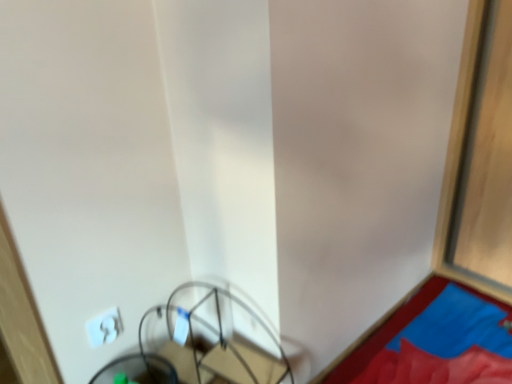
Question: Is the position of metallic wire swivel chair at lower left less distant than that of blue fabric at lower right?

Choices:
 (A) no
 (B) yes

Answer: (B)

Question: Does metallic wire swivel chair at lower left have a smaller size compared to blue fabric at lower right?

Choices:
 (A) no
 (B) yes

Answer: (B)

Question: Is metallic wire swivel chair at lower left taller than blue fabric at lower right?

Choices:
 (A) yes
 (B) no

Answer: (A)

Question: Does metallic wire swivel chair at lower left have a larger size compared to blue fabric at lower right?

Choices:
 (A) yes
 (B) no

Answer: (B)

Question: Can you confirm if metallic wire swivel chair at lower left is positioned to the right of blue fabric at lower right?

Choices:
 (A) no
 (B) yes

Answer: (A)

Question: Considering the positions of white plastic light switch at lower left and metal wire basket at lower center in the image, is white plastic light switch at lower left bigger or smaller than metal wire basket at lower center?

Choices:
 (A) small
 (B) big

Answer: (A)

Question: Considering the relative positions of white plastic light switch at lower left and metal wire basket at lower center in the image provided, is white plastic light switch at lower left to the left or to the right of metal wire basket at lower center?

Choices:
 (A) right
 (B) left

Answer: (B)

Question: Relative to metal wire basket at lower center, is white plastic light switch at lower left in front or behind?

Choices:
 (A) front
 (B) behind

Answer: (B)

Question: From a real-world perspective, is white plastic light switch at lower left physically located above or below metal wire basket at lower center?

Choices:
 (A) above
 (B) below

Answer: (A)

Question: Is point (141, 354) closer or farther from the camera than point (495, 374)?

Choices:
 (A) closer
 (B) farther

Answer: (B)

Question: From the image's perspective, relative to blue fabric at lower right, is metallic wire swivel chair at lower left above or below?

Choices:
 (A) above
 (B) below

Answer: (B)

Question: Looking at their shapes, would you say metallic wire swivel chair at lower left is wider or thinner than blue fabric at lower right?

Choices:
 (A) thin
 (B) wide

Answer: (A)

Question: From their relative heights in the image, would you say metallic wire swivel chair at lower left is taller or shorter than blue fabric at lower right?

Choices:
 (A) short
 (B) tall

Answer: (B)

Question: In terms of size, does white plastic light switch at lower left appear bigger or smaller than blue fabric at lower right?

Choices:
 (A) small
 (B) big

Answer: (A)

Question: From the image's perspective, is white plastic light switch at lower left positioned above or below blue fabric at lower right?

Choices:
 (A) above
 (B) below

Answer: (A)